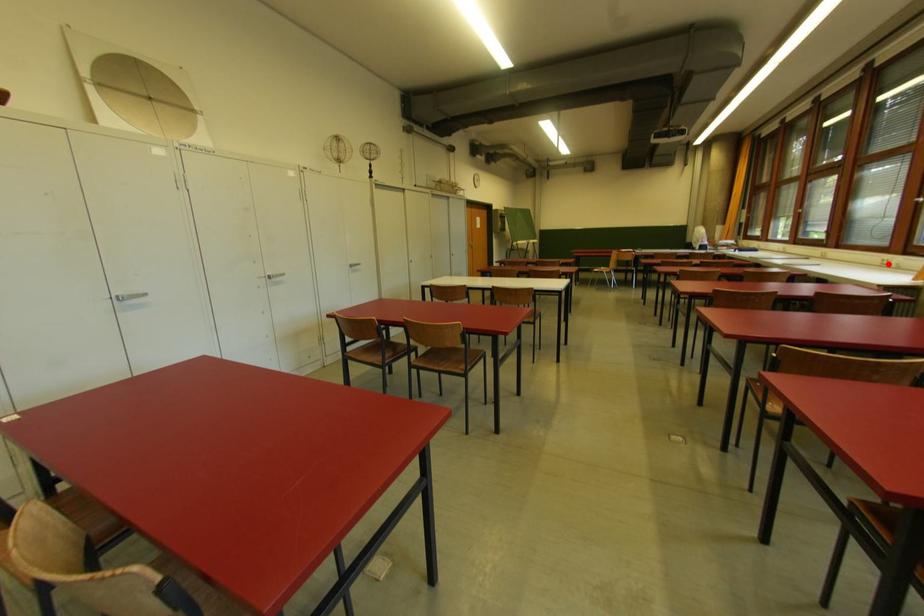
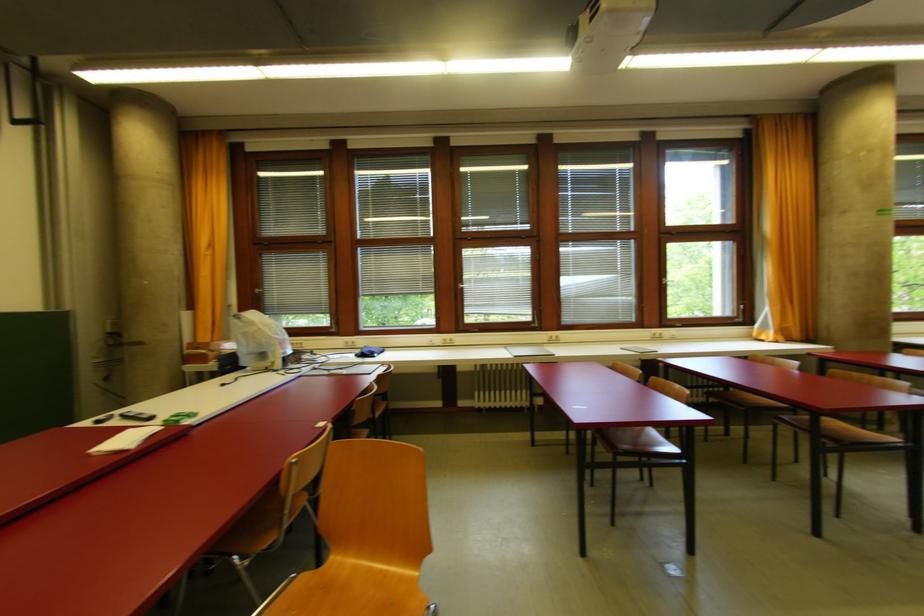
Question: I am providing you with two images of the same scene from different viewpoints. A red point is shown in image1. For the corresponding object point in image2, is it positioned nearer or farther from the camera?

Choices:
 (A) Nearer
 (B) Farther

Answer: (A)